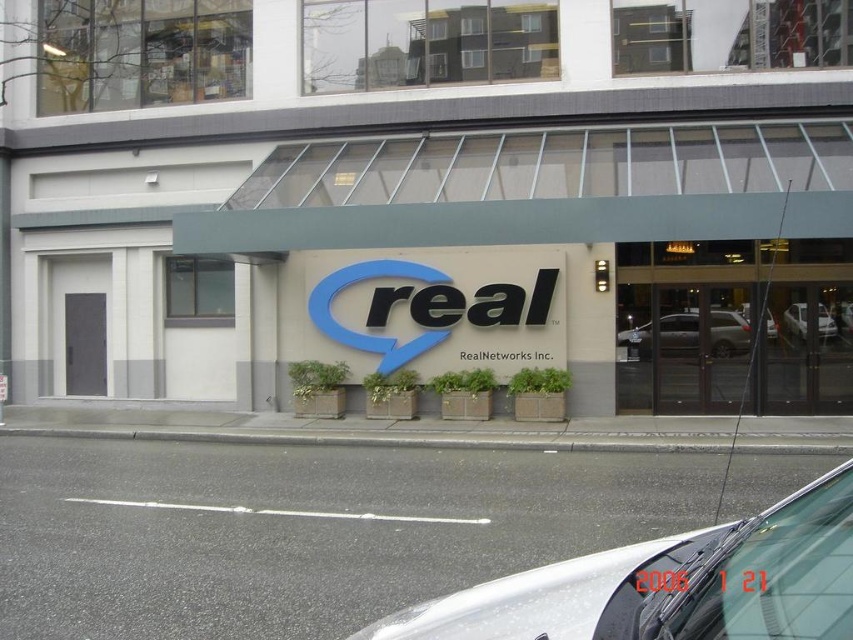
You are a delivery person approaching the RealNetworks Inc. building. You see the matte gray sign at center and the glass door at center. Which object is closer to you as you approach?

The matte gray sign at center is closer to the viewer than the glass door at center, so the matte gray sign at center is closer to you as you approach.

You are a delivery person arriving at the RealNetworks Inc. building. You see a silver metallic car at lower right and a blue plastic sign at center. Which object is shorter?

The silver metallic car at lower right has a lesser height compared to the blue plastic sign at center, so the silver metallic car at lower right is shorter.

You are a delivery person approaching the RealNetworks Inc. building and need to locate the entrance. You see a matte gray sign at center and a glass door at center. Which object is taller?

The matte gray sign at center is much taller than the glass door at center.